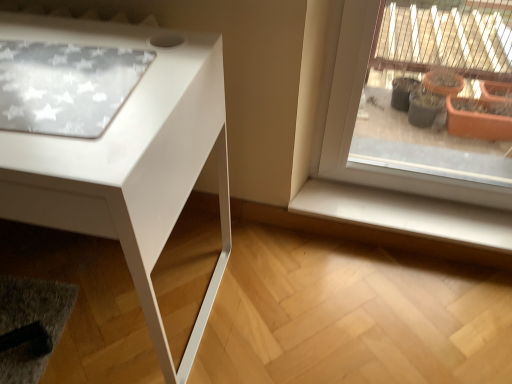
Question: Is white smooth window sill at lower right to the left or to the right of white glossy table at left in the image?

Choices:
 (A) right
 (B) left

Answer: (A)

Question: Considering the positions of white smooth window sill at lower right and white glossy table at left in the image, is white smooth window sill at lower right taller or shorter than white glossy table at left?

Choices:
 (A) short
 (B) tall

Answer: (A)

Question: Considering their positions, is white smooth window sill at lower right located in front of or behind white glossy table at left?

Choices:
 (A) behind
 (B) front

Answer: (A)

Question: Which is correct: white glossy table at left is inside white smooth window sill at lower right, or outside of it?

Choices:
 (A) inside
 (B) outside

Answer: (B)

Question: In the image, is white glossy table at left positioned in front of or behind white smooth window sill at lower right?

Choices:
 (A) behind
 (B) front

Answer: (B)

Question: In terms of height, does white glossy table at left look taller or shorter compared to white smooth window sill at lower right?

Choices:
 (A) short
 (B) tall

Answer: (B)

Question: From a real-world perspective, is white glossy table at left positioned above or below white smooth window sill at lower right?

Choices:
 (A) above
 (B) below

Answer: (A)